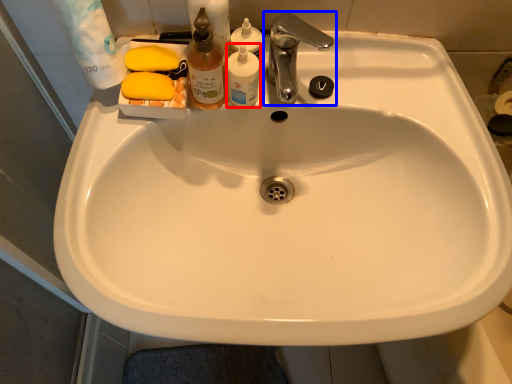
Question: Which of the following is the closest to the observer, toiletry (highlighted by a red box) or tap (highlighted by a blue box)?

Choices:
 (A) toiletry
 (B) tap

Answer: (B)